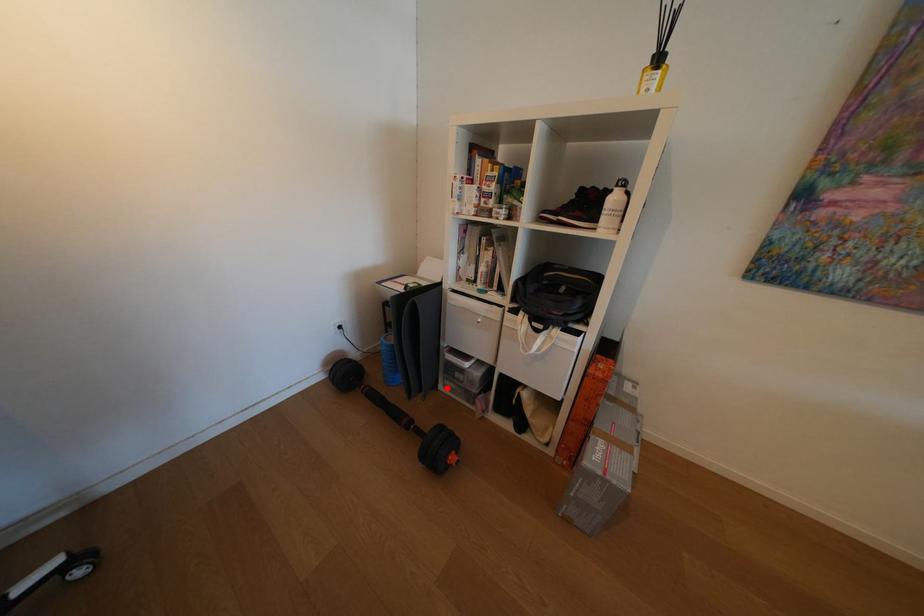
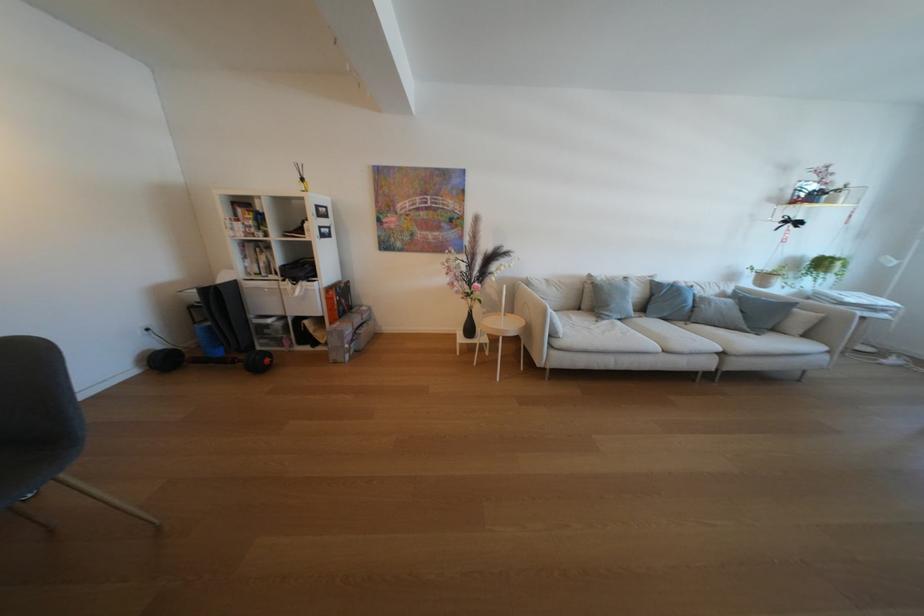
Question: I am providing you with two images of the same scene from different viewpoints. Image1 has a red point marked. In image2, the corresponding 3D location appears at what relative position? Reply with the corresponding letter.

Choices:
 (A) Closer
 (B) Farther

Answer: (A)